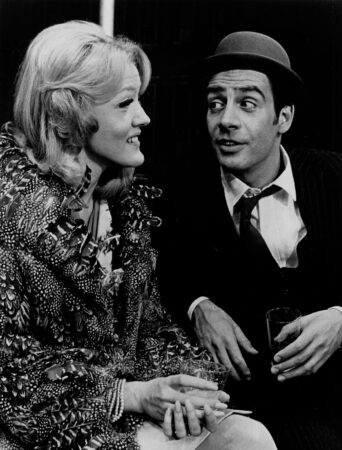
You are a GUI agent. You are given a task and a screenshot of the screen. Output one action in this format:
    pyautogui.click(x=<x>, y=<y>)
    Task: Click on the glass
    The image size is (342, 450).
    Given the screenshot: What is the action you would take?
    pyautogui.click(x=274, y=324), pyautogui.click(x=220, y=375)